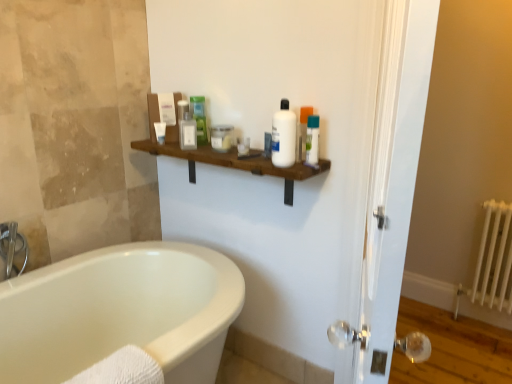
At what (x,y) coordinates should I click in order to perform the action: click on vacant region under white metal radiator at right (from a real-world perspective). Please return your answer as a coordinate pair (x, y). The height and width of the screenshot is (384, 512). Looking at the image, I should click on (479, 330).